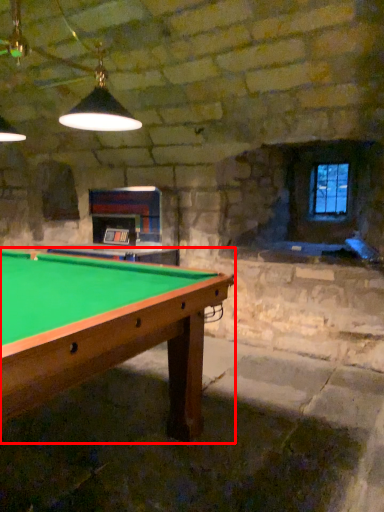
Question: From the image's perspective, what is the correct spatial relationship of billiard table (annotated by the red box) in relation to window?

Choices:
 (A) above
 (B) below

Answer: (B)